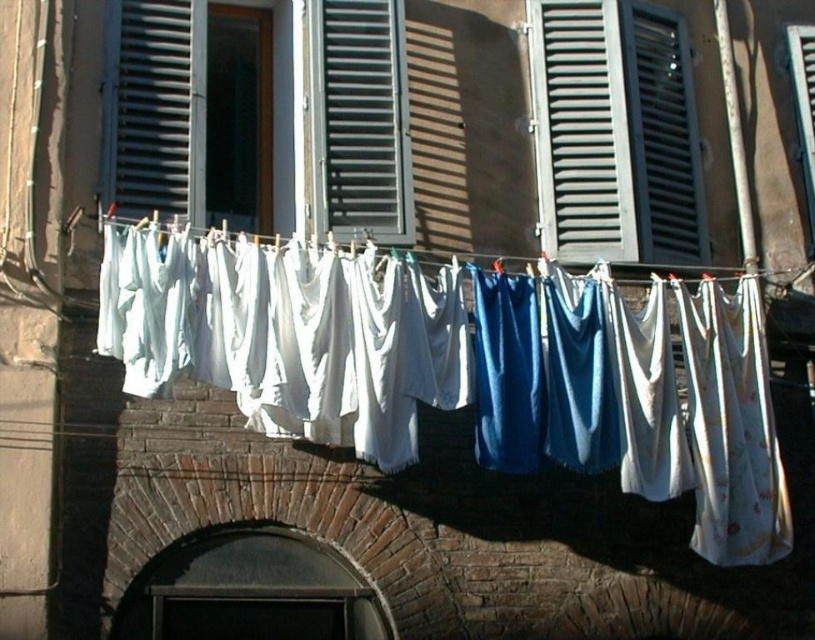
The width and height of the screenshot is (815, 640). What are the coordinates of `white cotton sheets at center` in the screenshot? It's located at (289, 333).

Does point (782, 465) come closer to viewer compared to point (337, 72)?

Yes, point (782, 465) is in front of point (337, 72).

The width and height of the screenshot is (815, 640). Identify the location of white cotton sheets at center. (289, 333).

Is matte gray shutters at upper right positioned in front of matte gray shutter at upper left?

No, matte gray shutters at upper right is further to the viewer.

In the scene shown: Who is taller, matte gray shutters at upper right or matte gray shutter at upper left?

matte gray shutters at upper right

Locate an element on the screen. matte gray shutters at upper right is located at coordinates (615, 132).

Does matte gray shutters at upper right have a smaller size compared to white fabric at center?

Indeed, matte gray shutters at upper right has a smaller size compared to white fabric at center.

Between matte gray shutters at upper right and white fabric at center, which one has more height?

With more height is matte gray shutters at upper right.

At what (x,y) coordinates should I click in order to perform the action: click on matte gray shutters at upper right. Please return your answer as a coordinate pair (x, y). Image resolution: width=815 pixels, height=640 pixels. Looking at the image, I should click on click(615, 132).

The width and height of the screenshot is (815, 640). Find the location of `matte gray shutters at upper right`. matte gray shutters at upper right is located at coordinates (615, 132).